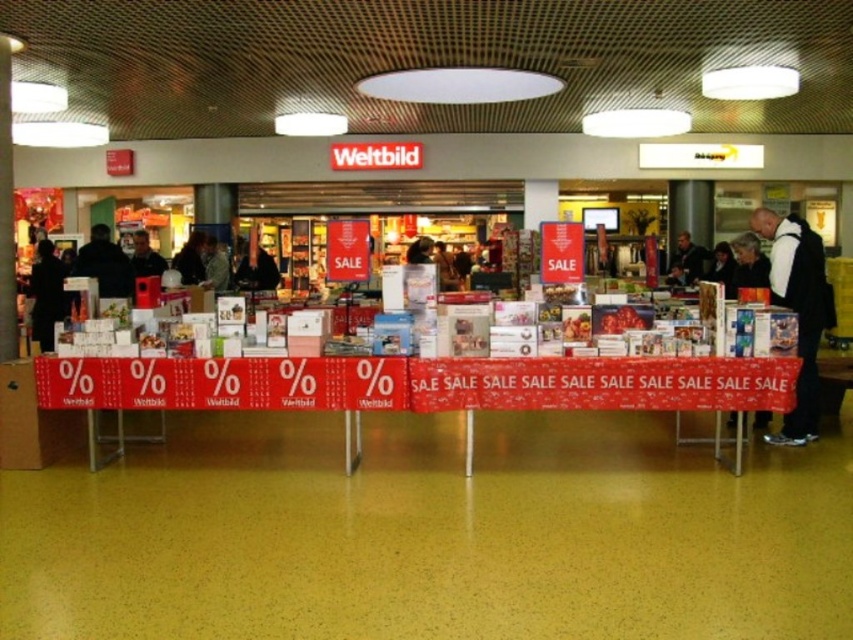
Question: Is red fabric banner at center smaller than dark gray sweater at center?

Choices:
 (A) yes
 (B) no

Answer: (B)

Question: Does black fabric jacket at right appear over dark hair at center?

Choices:
 (A) no
 (B) yes

Answer: (A)

Question: Among these points, which one is farthest from the camera?

Choices:
 (A) (670, 266)
 (B) (200, 237)
 (C) (138, 230)

Answer: (C)

Question: Based on their relative distances, which object is farther from the dark gray sweater at center?

Choices:
 (A) red fabric banner at center
 (B) dark gray suit at center

Answer: (B)

Question: Where is red fabric banner at center located in relation to dark gray suit at center in the image?

Choices:
 (A) above
 (B) below

Answer: (B)

Question: Which object is positioned closest to the dark gray coat at left?

Choices:
 (A) red fabric banner at center
 (B) dark hair at center
 (C) black fabric jacket at right
 (D) black fabric jacket at center

Answer: (B)